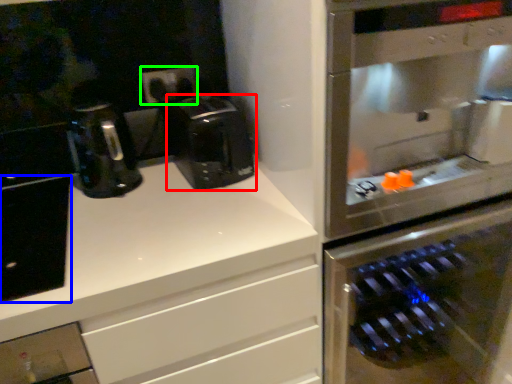
Question: Based on their relative distances, which object is farther from coffee maker (highlighted by a red box)? Choose from cabinetry (highlighted by a blue box) and electric outlet (highlighted by a green box).

Choices:
 (A) cabinetry
 (B) electric outlet

Answer: (A)